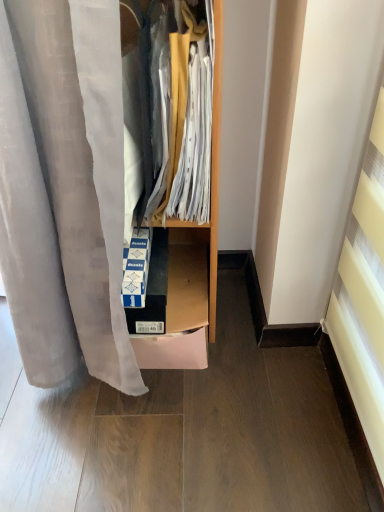
Question: From a real-world perspective, is wooden cabinet at center located higher than cardboard box at center?

Choices:
 (A) no
 (B) yes

Answer: (B)

Question: Does wooden cabinet at center have a lesser width compared to cardboard box at center?

Choices:
 (A) yes
 (B) no

Answer: (A)

Question: Can you confirm if wooden cabinet at center is taller than cardboard box at center?

Choices:
 (A) yes
 (B) no

Answer: (A)

Question: From the image's perspective, would you say wooden cabinet at center is positioned over cardboard box at center?

Choices:
 (A) no
 (B) yes

Answer: (B)

Question: Does wooden cabinet at center lie behind cardboard box at center?

Choices:
 (A) no
 (B) yes

Answer: (A)

Question: Does wooden cabinet at center have a lesser height compared to cardboard box at center?

Choices:
 (A) yes
 (B) no

Answer: (B)

Question: Is cardboard box at center turned away from wooden cabinet at center?

Choices:
 (A) no
 (B) yes

Answer: (A)

Question: From a real-world perspective, does cardboard box at center stand above wooden cabinet at center?

Choices:
 (A) no
 (B) yes

Answer: (A)

Question: Is cardboard box at center in front of wooden cabinet at center?

Choices:
 (A) no
 (B) yes

Answer: (A)

Question: Considering the relative sizes of cardboard box at center and wooden cabinet at center in the image provided, is cardboard box at center smaller than wooden cabinet at center?

Choices:
 (A) no
 (B) yes

Answer: (B)

Question: Is cardboard box at center completely or partially outside of wooden cabinet at center?

Choices:
 (A) no
 (B) yes

Answer: (B)

Question: From the image's perspective, is cardboard box at center beneath wooden cabinet at center?

Choices:
 (A) yes
 (B) no

Answer: (A)

Question: Considering the positions of wooden cabinet at center and cardboard box at center in the image, is wooden cabinet at center bigger or smaller than cardboard box at center?

Choices:
 (A) big
 (B) small

Answer: (A)